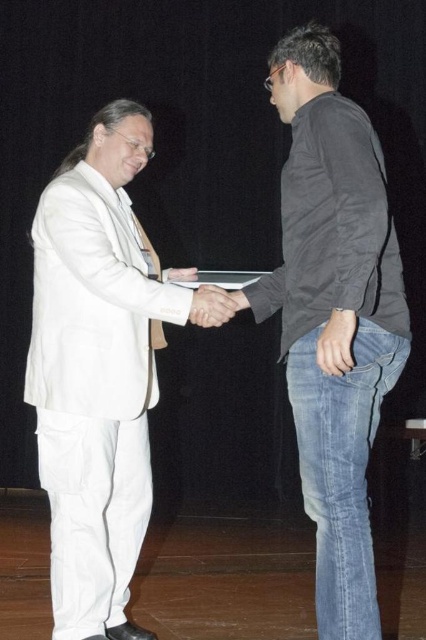
How distant is white matte suit at left from matte black hand at center?

white matte suit at left and matte black hand at center are 36.29 inches apart.

Between point (49, 260) and point (333, 353), which one is positioned in front?

Point (333, 353)

What are the coordinates of `white matte suit at left` in the screenshot? It's located at (97, 371).

Is point (362, 236) closer to camera compared to point (201, 307)?

Yes.

Between dark gray cotton shirt at center and white matte hand at center, which one is positioned lower?

dark gray cotton shirt at center is below.

Describe the element at coordinates (331, 310) in the screenshot. The image size is (426, 640). I see `dark gray cotton shirt at center` at that location.

Where is `dark gray cotton shirt at center`? The height and width of the screenshot is (640, 426). dark gray cotton shirt at center is located at coordinates (331, 310).

Is point (58, 433) farther from viewer compared to point (227, 298)?

No, (58, 433) is in front of (227, 298).

Does white matte suit at left have a larger size compared to white matte hand at center?

Yes.

Where is `white matte suit at left`? Image resolution: width=426 pixels, height=640 pixels. white matte suit at left is located at coordinates (97, 371).